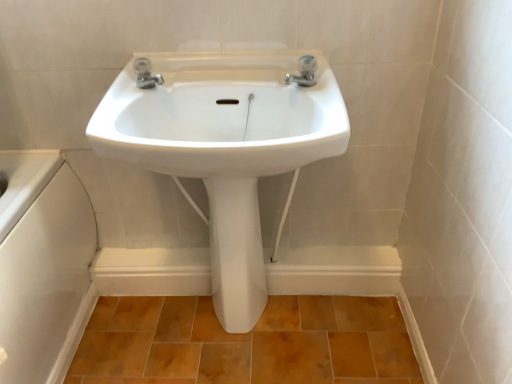
Question: Is the depth of brown matte tile at lower center less than that of white glossy pedestal at center?

Choices:
 (A) no
 (B) yes

Answer: (A)

Question: Is brown matte tile at lower center wider than white glossy pedestal at center?

Choices:
 (A) yes
 (B) no

Answer: (A)

Question: From the image's perspective, is brown matte tile at lower center located above white glossy pedestal at center?

Choices:
 (A) yes
 (B) no

Answer: (B)

Question: Is brown matte tile at lower center oriented towards white glossy pedestal at center?

Choices:
 (A) no
 (B) yes

Answer: (B)

Question: Is brown matte tile at lower center not inside white glossy pedestal at center?

Choices:
 (A) yes
 (B) no

Answer: (A)

Question: Is point (312, 72) positioned closer to the camera than point (226, 289)?

Choices:
 (A) farther
 (B) closer

Answer: (B)

Question: Considering the positions of silver metallic tap at upper center, which is the second tap from left to right, and white glossy pedestal at center in the image, is silver metallic tap at upper center, which is the second tap from left to right, bigger or smaller than white glossy pedestal at center?

Choices:
 (A) big
 (B) small

Answer: (B)

Question: In the image, is silver metallic tap at upper center, which is the second tap from left to right, positioned in front of or behind white glossy pedestal at center?

Choices:
 (A) behind
 (B) front

Answer: (B)

Question: Looking at their shapes, would you say silver metallic tap at upper center, the 1th tap from the right, is wider or thinner than white glossy pedestal at center?

Choices:
 (A) wide
 (B) thin

Answer: (B)

Question: Is white glossy pedestal at center wider or thinner than brown matte tile at lower center?

Choices:
 (A) wide
 (B) thin

Answer: (B)

Question: Considering the positions of white glossy pedestal at center and brown matte tile at lower center in the image, is white glossy pedestal at center taller or shorter than brown matte tile at lower center?

Choices:
 (A) short
 (B) tall

Answer: (B)

Question: Is white glossy pedestal at center bigger or smaller than brown matte tile at lower center?

Choices:
 (A) big
 (B) small

Answer: (B)

Question: Considering their positions, is white glossy pedestal at center located in front of or behind brown matte tile at lower center?

Choices:
 (A) behind
 (B) front

Answer: (B)

Question: From a real-world perspective, relative to satin nickel faucet at upper center, the second tap from the right, is silver metallic tap at upper center, the 1th tap from the right, vertically above or below?

Choices:
 (A) below
 (B) above

Answer: (A)

Question: Does point (312, 69) appear closer or farther from the camera than point (147, 61)?

Choices:
 (A) closer
 (B) farther

Answer: (A)